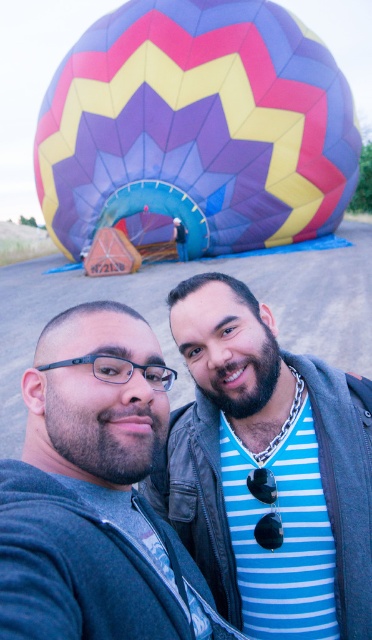
Looking at this image, you are standing at the point marked as point (200, 122) in the image. What object are you touching?

The point (200, 122) is on the multicolored fabric balloon at upper center, so you are touching the multicolored fabric balloon at upper center.

You are standing in front of the hot air balloon and want to take a photo of the two points marked in the scene. Which point, point (238, 152) or point (335, 413), is closer to you?

Point (238, 152) is closer to you than point (335, 413) because it is further to the viewer.

Consider the image. You are a photographer trying to frame a shot of the two men and the hot air balloon. Given that the multicolored fabric balloon at upper center is wider than the matte black jacket at center, which object should you focus on first to ensure both fit in the frame?

Since the multicolored fabric balloon at upper center is wider than the matte black jacket at center, you should focus on framing the multicolored fabric balloon at upper center first to ensure both objects fit within the camera frame.